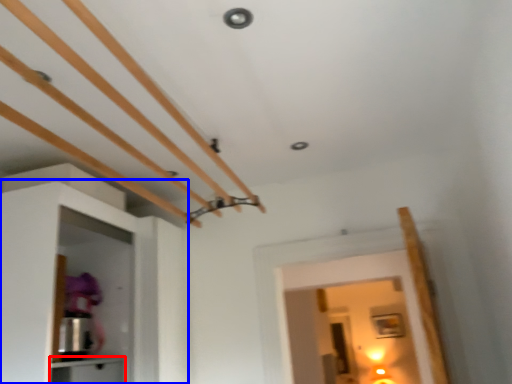
Question: Which object appears farthest to the camera in this image, cabinetry (highlighted by a red box) or cabinetry (highlighted by a blue box)?

Choices:
 (A) cabinetry
 (B) cabinetry

Answer: (A)